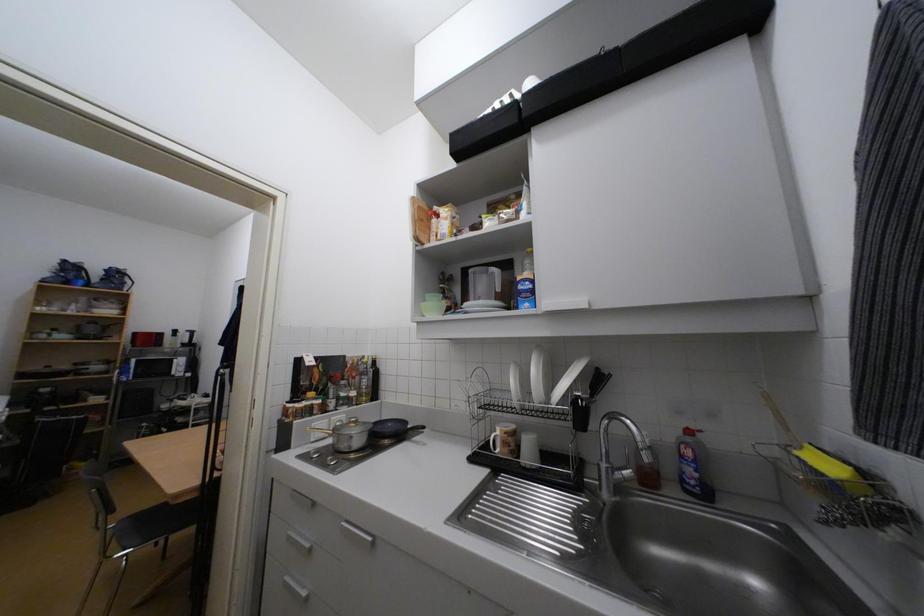
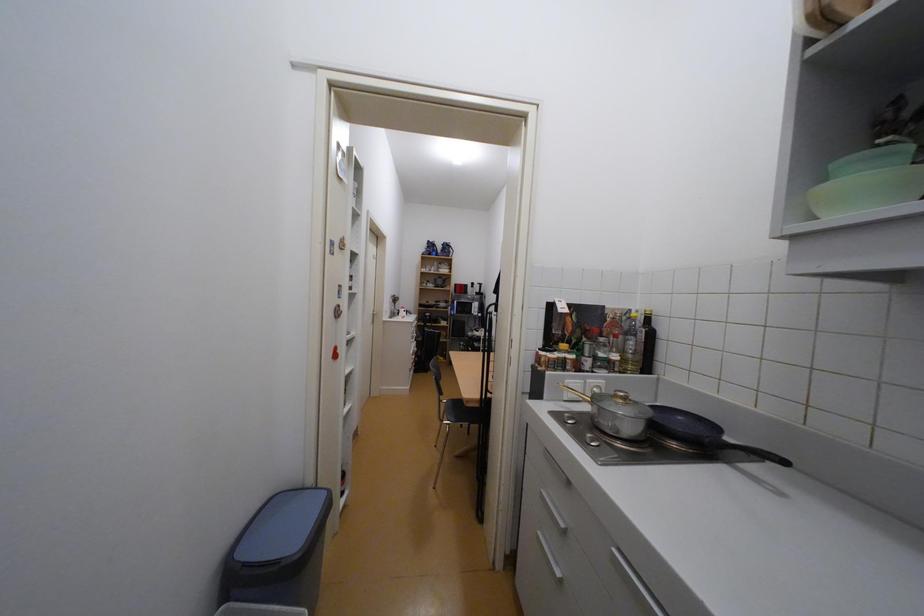
Question: The camera is either moving clockwise (left) or counter-clockwise (right) around the object. The first image is from the beginning of the video and the second image is from the end. Is the camera moving left or right when shooting the video?

Choices:
 (A) Left
 (B) Right

Answer: (B)